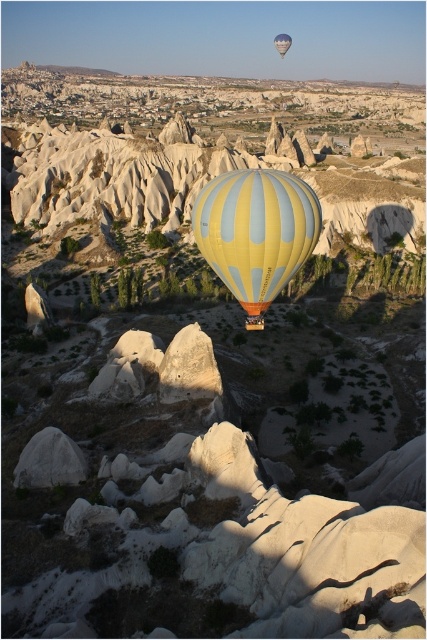
Question: Can you confirm if yellow striped balloon at center is smaller than yellow striped fabric hot air balloon at center?

Choices:
 (A) no
 (B) yes

Answer: (A)

Question: Can you confirm if yellow striped balloon at center is positioned to the right of yellow striped fabric hot air balloon at center?

Choices:
 (A) no
 (B) yes

Answer: (A)

Question: Which point is farther to the camera?

Choices:
 (A) yellow striped balloon at center
 (B) yellow striped fabric hot air balloon at center

Answer: (B)

Question: Is yellow striped balloon at center to the left of yellow striped fabric hot air balloon at center from the viewer's perspective?

Choices:
 (A) yes
 (B) no

Answer: (A)